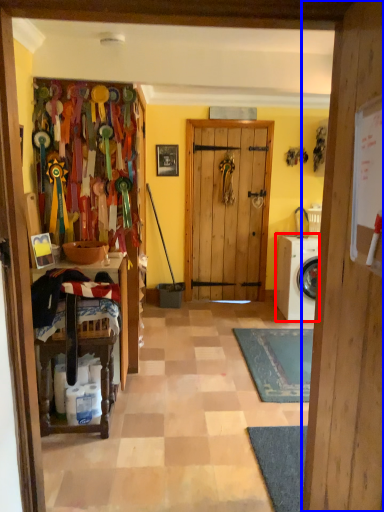
Question: Which of the following is the farthest to the observer, washing machine (highlighted by a red box) or door (highlighted by a blue box)?

Choices:
 (A) washing machine
 (B) door

Answer: (A)